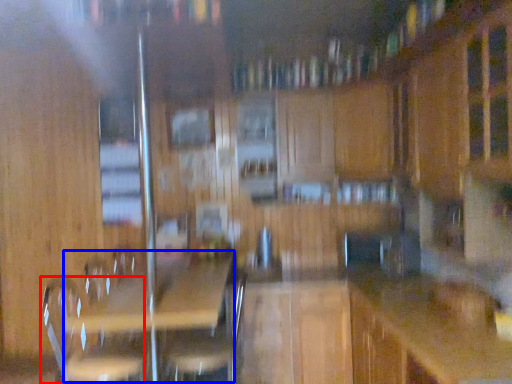
Question: Which point is further to the camera, swivel chair (highlighted by a red box) or picnic table (highlighted by a blue box)?

Choices:
 (A) swivel chair
 (B) picnic table

Answer: (A)